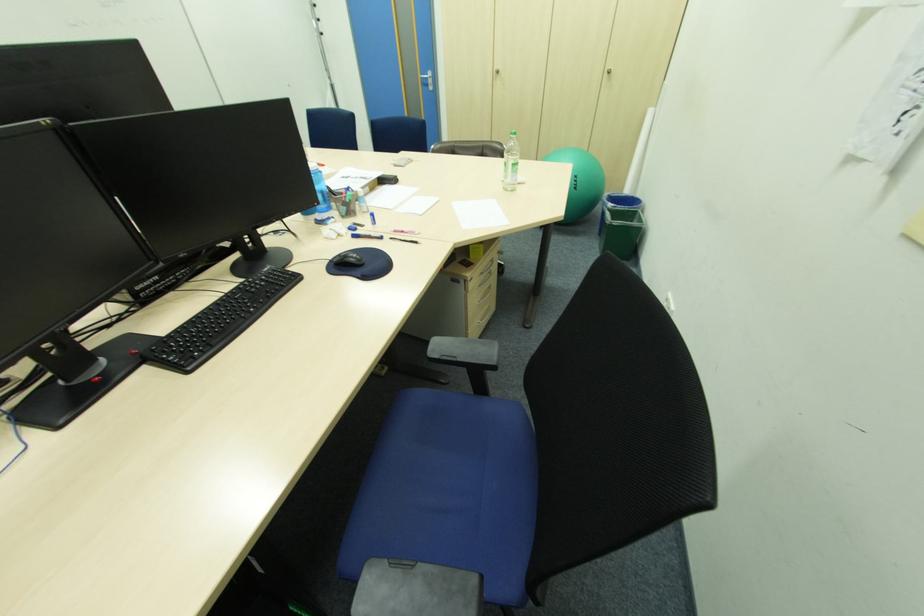
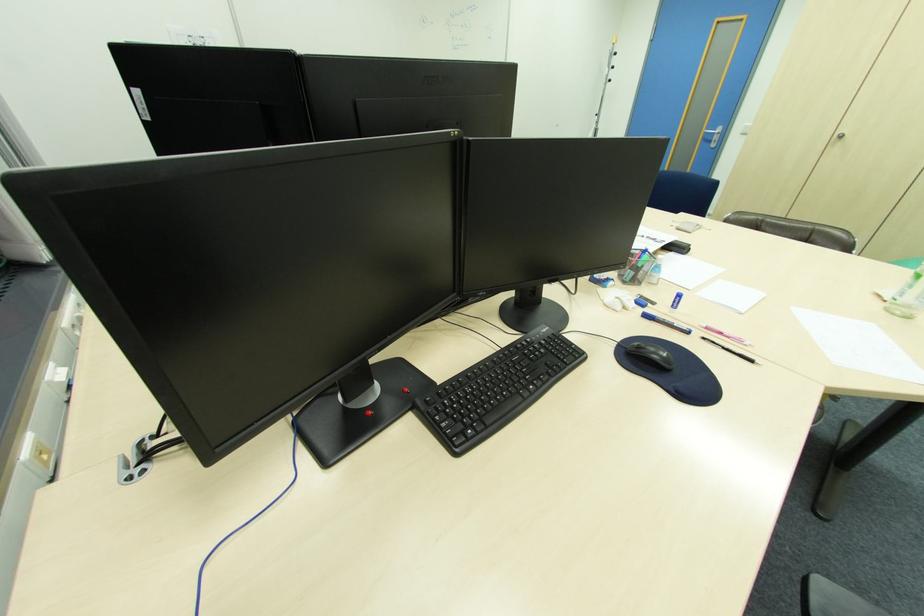
The point at (357, 260) is marked in the first image. Where is the corresponding point in the second image?

(662, 358)